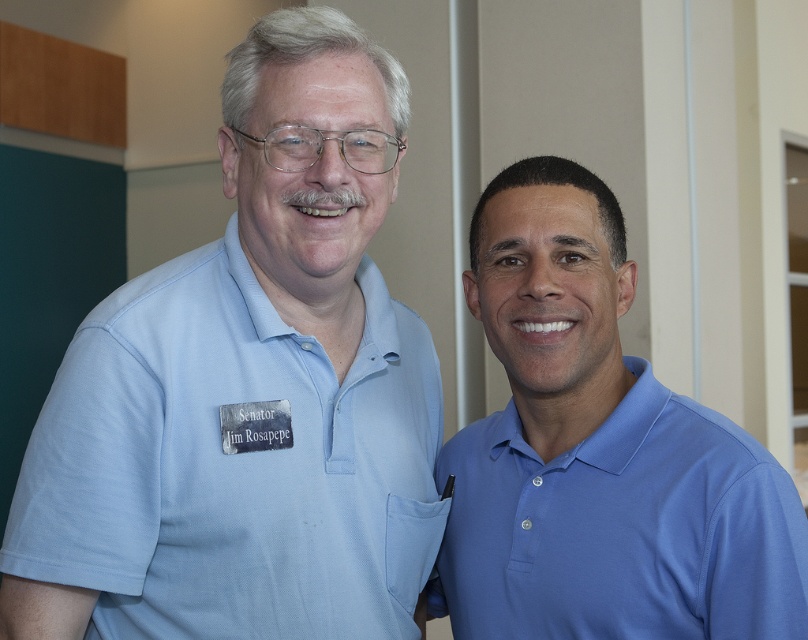
Question: Is light blue polo shirt at left thinner than blue smooth polo shirt at right?

Choices:
 (A) no
 (B) yes

Answer: (A)

Question: Is light blue polo shirt at left smaller than blue smooth polo shirt at right?

Choices:
 (A) yes
 (B) no

Answer: (B)

Question: Is light blue polo shirt at left above blue smooth polo shirt at right?

Choices:
 (A) no
 (B) yes

Answer: (B)

Question: Which object is farther from the camera taking this photo?

Choices:
 (A) light blue polo shirt at left
 (B) blue smooth polo shirt at right

Answer: (A)

Question: Among these objects, which one is farthest from the camera?

Choices:
 (A) light blue polo shirt at left
 (B) blue smooth polo shirt at right

Answer: (A)